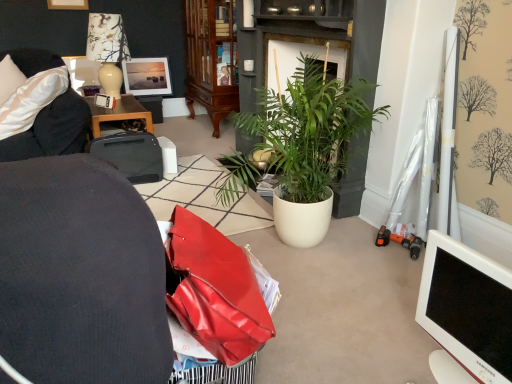
Question: From the image's perspective, relative to black plastic printer at center, is black plastic printer at upper left above or below?

Choices:
 (A) above
 (B) below

Answer: (A)

Question: From their relative heights in the image, would you say black plastic printer at upper left is taller or shorter than black plastic printer at center?

Choices:
 (A) tall
 (B) short

Answer: (A)

Question: Considering the real-world distances, which object is farthest from the black plastic printer at center?

Choices:
 (A) mahogany glass-front cabinet at center
 (B) white plastic monitor at lower right
 (C) white glossy lamp at upper left
 (D) green leafy plant at center
 (E) wooden picture frame at upper left, the 1th picture frame in the front-to-back sequence

Answer: (B)

Question: Estimate the real-world distances between objects in this image. Which object is farther from the mahogany glass-front cabinet at center?

Choices:
 (A) black plastic printer at center
 (B) green leafy plant at center
 (C) black plastic printer at upper left
 (D) satin cushioned sofa at left
 (E) white glossy lamp at upper left

Answer: (B)